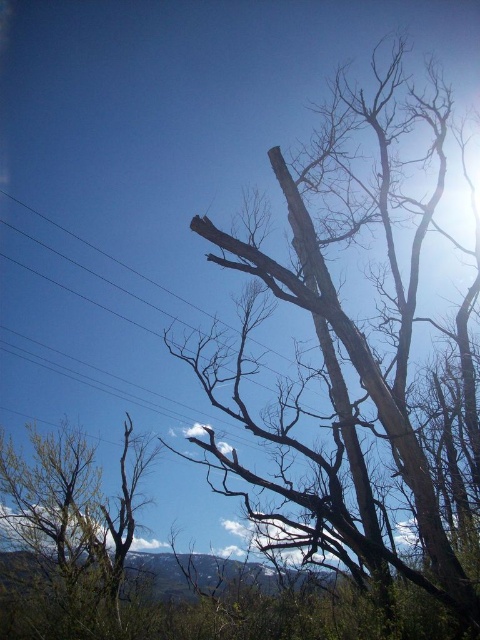
You are an ornithologist observing birds in the forest. You notice a brown rough bark tree at center and a green leafy tree at lower left. Which tree would you recommend for nesting based on their height?

The brown rough bark tree at center is taller than the green leafy tree at lower left, so it would be a better choice for nesting due to its height providing better protection and visibility.

You are a bird looking for a place to perch. You see the brown rough bark tree at center and the green leafy tree at lower left. Which tree is located higher in the image?

The brown rough bark tree at center is located higher in the image than the green leafy tree at lower left.